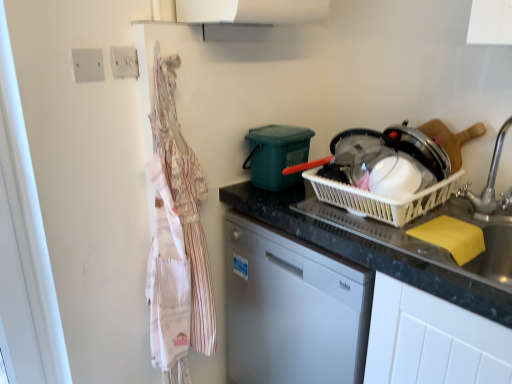
Question: Considering the positions of white plastic basket at center and white plastic electric outlet at upper left, arranged as the 1th electric outlet when viewed from the right, in the image, is white plastic basket at center taller or shorter than white plastic electric outlet at upper left, arranged as the 1th electric outlet when viewed from the right,?

Choices:
 (A) short
 (B) tall

Answer: (B)

Question: Would you say white plastic basket at center is to the left or to the right of white plastic electric outlet at upper left, arranged as the 1th electric outlet when viewed from the right, in the picture?

Choices:
 (A) left
 (B) right

Answer: (B)

Question: Estimate the real-world distances between objects in this image. Which object is closer to the striped cotton apron at left?

Choices:
 (A) black granite countertop at center
 (B) white plastic basket at center
 (C) white plastic electric outlet at upper left, the first electric outlet viewed from the back
 (D) silver metallic faucet at right
 (E) white plastic electric outlet at upper left, which is the second electric outlet from back to front

Answer: (A)

Question: Based on their relative distances, which object is nearer to the black granite countertop at center?

Choices:
 (A) white plastic electric outlet at upper left, the first electric outlet viewed from the back
 (B) silver metallic faucet at right
 (C) yellow sponge at sink
 (D) striped cotton apron at left
 (E) white plastic electric outlet at upper left, which is the second electric outlet from back to front

Answer: (C)